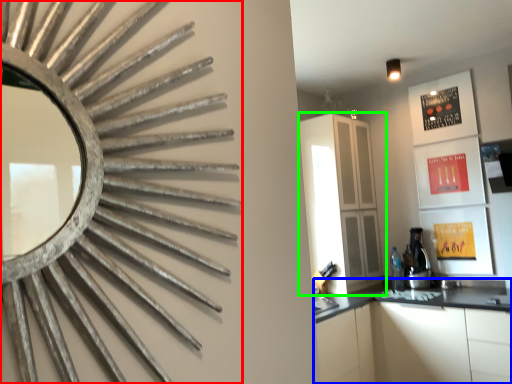
Question: Which is farther away from mirror (highlighted by a red box)? cabinetry (highlighted by a blue box) or cabinetry (highlighted by a green box)?

Choices:
 (A) cabinetry
 (B) cabinetry

Answer: (B)